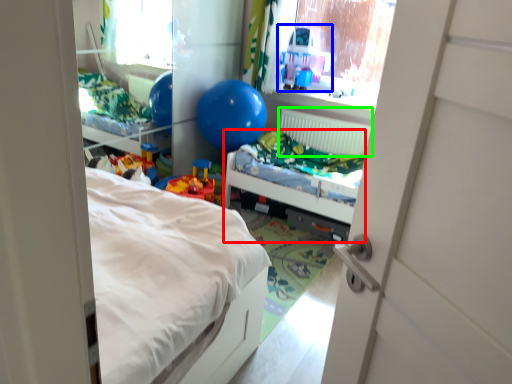
Question: Which object is the farthest from hospital bed (highlighted by a red box)? Choose among these: toy (highlighted by a blue box) or radiator (highlighted by a green box).

Choices:
 (A) toy
 (B) radiator

Answer: (A)